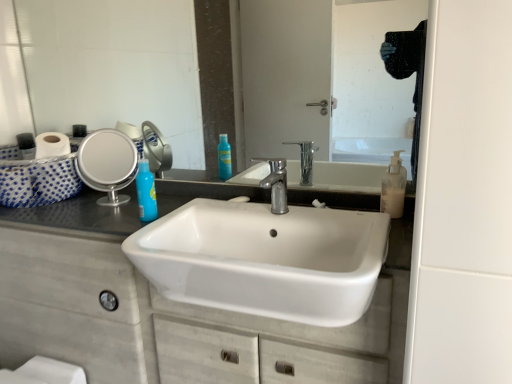
The image size is (512, 384). I want to click on free spot behind polished chrome faucet at center, so pos(268,197).